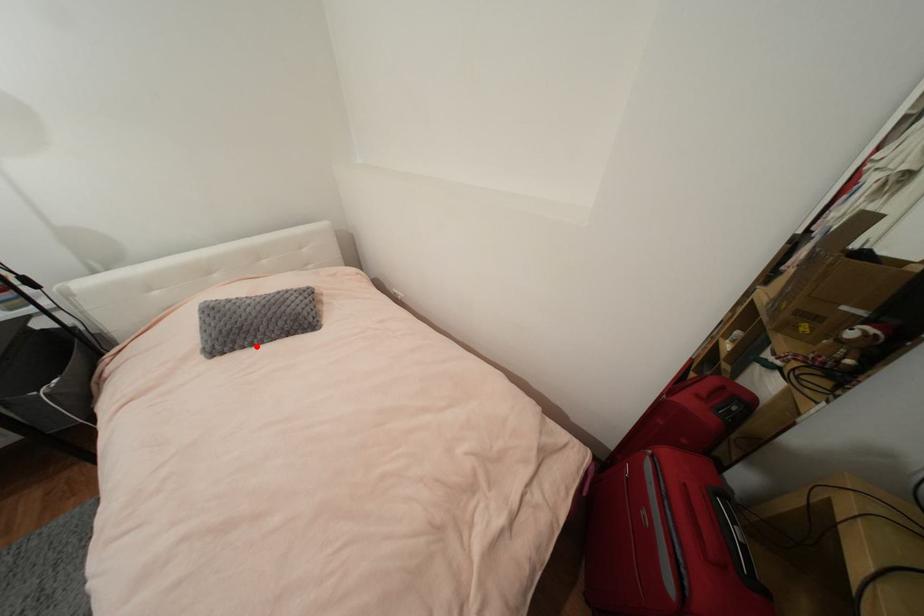
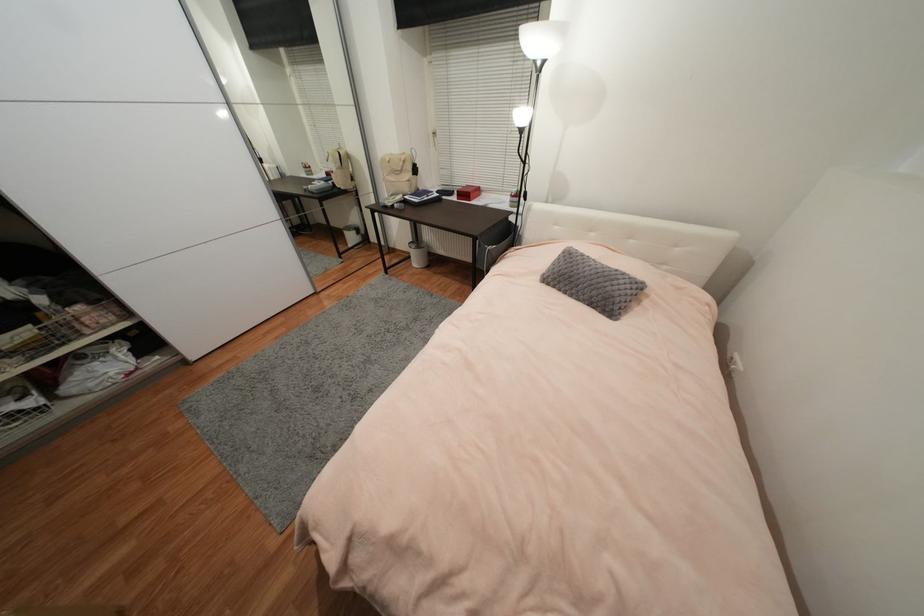
In the second image, find the point that corresponds to the highlighted location in the first image.

(569, 294)